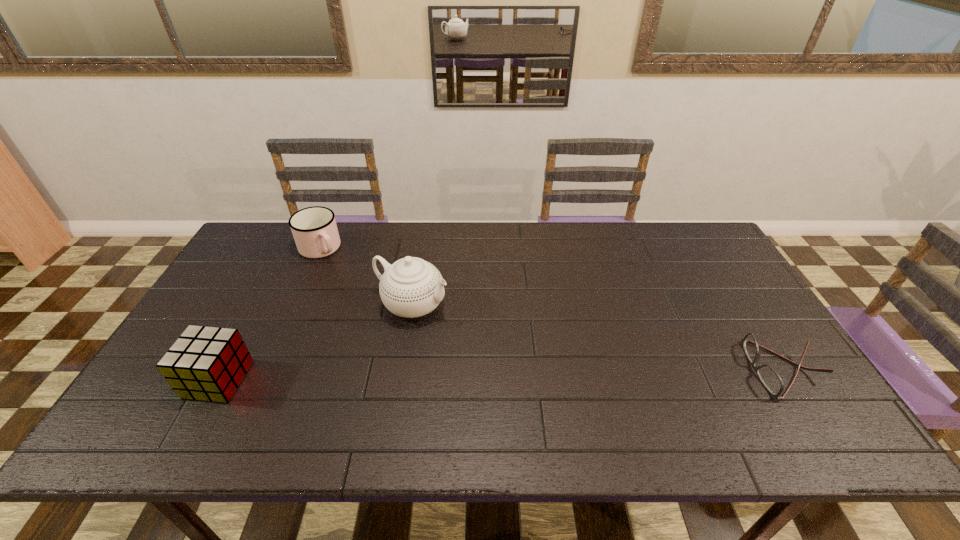
Where is `vacant region located on the spout of the third object from left to right`? The width and height of the screenshot is (960, 540). vacant region located on the spout of the third object from left to right is located at coordinates (571, 368).

Image resolution: width=960 pixels, height=540 pixels. What are the coordinates of `free space located on the spout of the third object from left to right` in the screenshot? It's located at (468, 326).

At what (x,y) coordinates should I click in order to perform the action: click on free space located on the spout of the third object from left to right. Please return your answer as a coordinate pair (x, y). Looking at the image, I should click on (564, 366).

Locate an element on the screen. free space located 0.210m on the side of the farthest object with the handle is located at coordinates (359, 295).

Image resolution: width=960 pixels, height=540 pixels. I want to click on free region located 0.220m on the side of the farthest object with the handle, so click(360, 298).

Identify the location of free space located on the side of the farthest object with the handle. The width and height of the screenshot is (960, 540). (380, 320).

Identify the location of object located in the far edge section of the desktop. (314, 229).

The height and width of the screenshot is (540, 960). I want to click on cube located in the near edge section of the desktop, so click(x=205, y=363).

Where is `spectacles at the near edge`? spectacles at the near edge is located at coordinates (771, 380).

You are a GUI agent. You are given a task and a screenshot of the screen. Output one action in this format:
    pyautogui.click(x=<x>, y=<y>)
    Task: Click on the object that is at the left edge
    The image size is (960, 540).
    Given the screenshot: What is the action you would take?
    pyautogui.click(x=205, y=363)